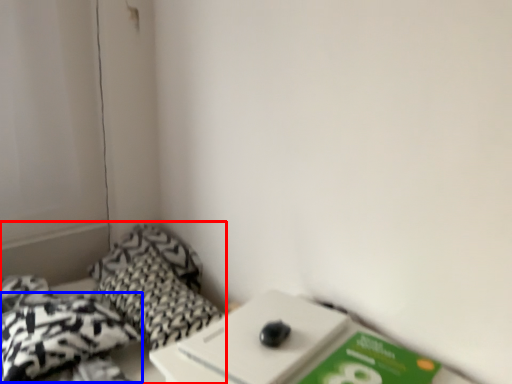
Question: Which of the following is the farthest to the observer, bed (highlighted by a red box) or throw pillow (highlighted by a blue box)?

Choices:
 (A) bed
 (B) throw pillow

Answer: (B)